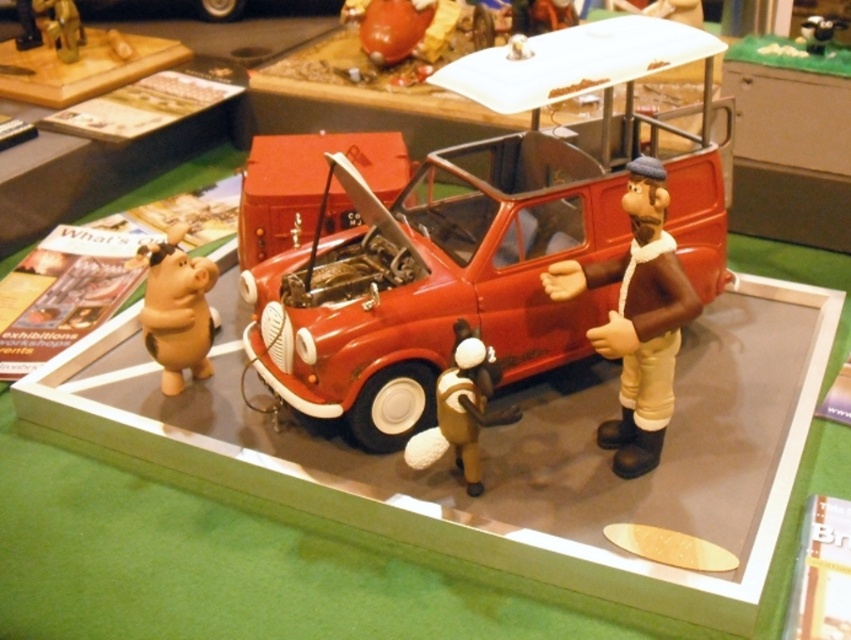
Question: Does brown matte figure at center have a lesser width compared to brown matte figure at left?

Choices:
 (A) yes
 (B) no

Answer: (B)

Question: Where is brown matte figure at center located in relation to matte brown figure at center in the image?

Choices:
 (A) right
 (B) left

Answer: (A)

Question: Which of these objects is positioned farthest from the brown matte figure at left?

Choices:
 (A) matte brown figure at center
 (B) shiny red car at center

Answer: (A)

Question: Based on their relative distances, which object is nearer to the brown matte figure at center?

Choices:
 (A) matte brown figure at center
 (B) brown matte figure at left

Answer: (A)

Question: Does brown matte figure at center appear under brown matte figure at left?

Choices:
 (A) yes
 (B) no

Answer: (A)

Question: Which of the following is the closest to the observer?

Choices:
 (A) shiny red car at center
 (B) brown matte figure at left

Answer: (A)